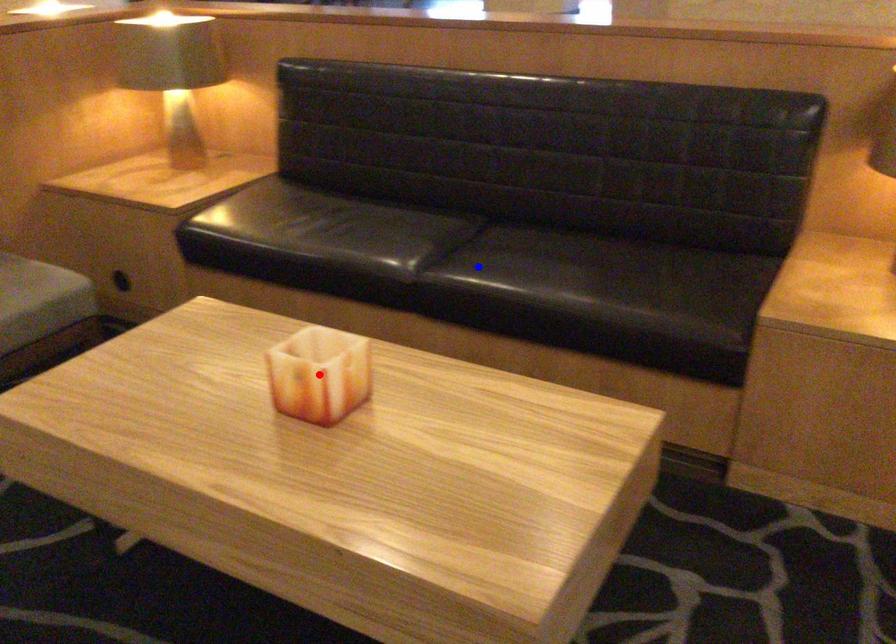
Question: In the image, two points are highlighted. Which point is nearer to the camera? Reply with the corresponding letter.

Choices:
 (A) blue point
 (B) red point

Answer: (B)